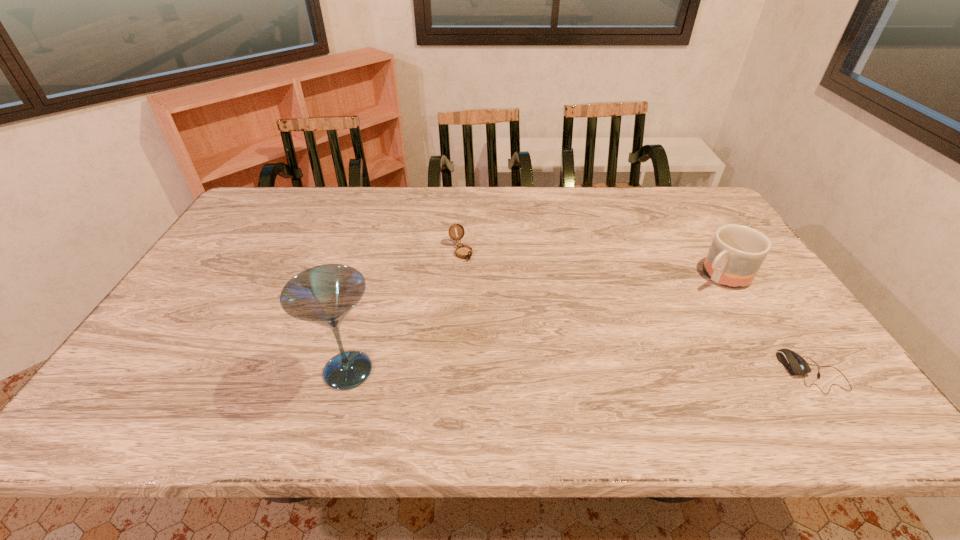
I want to click on vacant space situated 0.120m on the face of the third tallest object, so click(482, 287).

Locate an element on the screen. Image resolution: width=960 pixels, height=540 pixels. vacant space located on the side with the handle of the third shortest object is located at coordinates pyautogui.click(x=671, y=307).

Identify the location of vacant space located on the side with the handle of the third shortest object. Image resolution: width=960 pixels, height=540 pixels. coord(666,310).

Find the location of `free space located 0.140m on the side with the handle of the third shortest object`. free space located 0.140m on the side with the handle of the third shortest object is located at coordinates (673, 305).

I want to click on martini at the near edge, so [324, 295].

Locate an element on the screen. The height and width of the screenshot is (540, 960). computer mouse that is at the near edge is located at coordinates (796, 365).

Where is `computer mouse positioned at the right edge`? The height and width of the screenshot is (540, 960). computer mouse positioned at the right edge is located at coordinates (796, 365).

The width and height of the screenshot is (960, 540). Identify the location of mug located at the right edge. (737, 252).

Find the location of a particular element. The width and height of the screenshot is (960, 540). object situated at the near right corner is located at coordinates (796, 365).

This screenshot has height=540, width=960. In order to click on vacant space at the far edge of the desktop in this screenshot , I will do `click(523, 208)`.